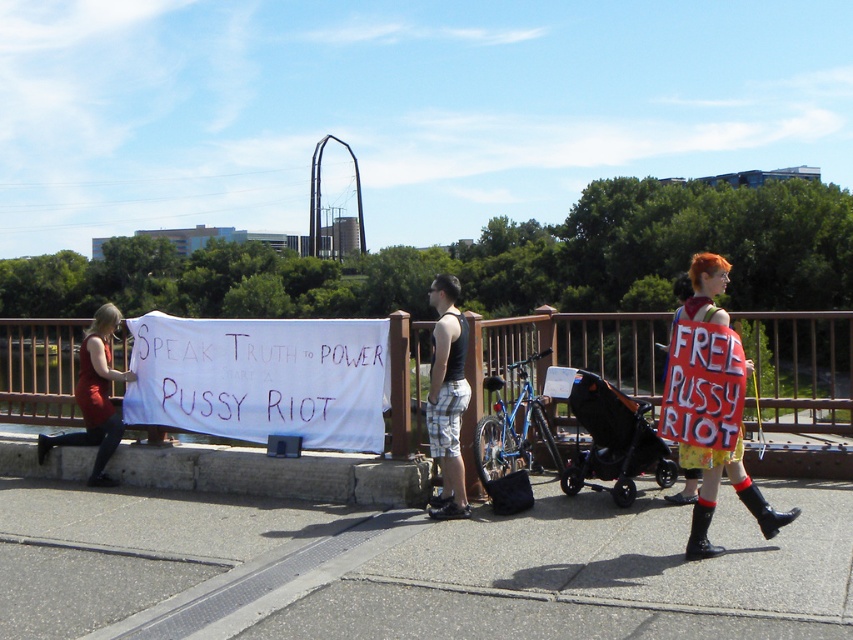
Is white fabric banner at center wider than red fabric sign at right?

Incorrect, white fabric banner at center's width does not surpass red fabric sign at right's.

Does point (164, 314) lie in front of point (714, 294)?

No.

Between point (227, 344) and point (694, 278), which one is positioned behind?

The point (227, 344) is more distant.

Identify the location of white fabric banner at center. (262, 378).

Between white fabric banner at center and matte red dress at left, which one has more height?

Standing taller between the two is matte red dress at left.

Does white fabric banner at center appear over matte red dress at left?

No, white fabric banner at center is not above matte red dress at left.

Who is more forward, (347,328) or (94,396)?

Point (347,328) is in front.

I want to click on white fabric banner at center, so click(262, 378).

Between black fabric stroller at center and matte red dress at left, which one has less height?

black fabric stroller at center

Does black fabric stroller at center appear under matte red dress at left?

Yes.

Which is behind, point (650, 452) or point (71, 442)?

The point (71, 442) is behind.

Where is `black fabric stroller at center`? black fabric stroller at center is located at coordinates (613, 440).